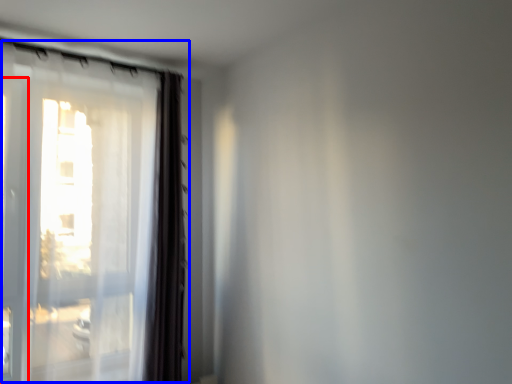
Question: Which of the following is the farthest to the observer, screen door (highlighted by a red box) or window (highlighted by a blue box)?

Choices:
 (A) screen door
 (B) window

Answer: (B)